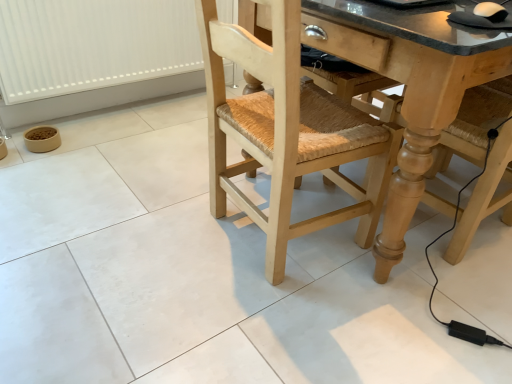
Locate an element on the screen. The image size is (512, 384). unoccupied region to the right of white plastic radiator at lower left is located at coordinates (174, 122).